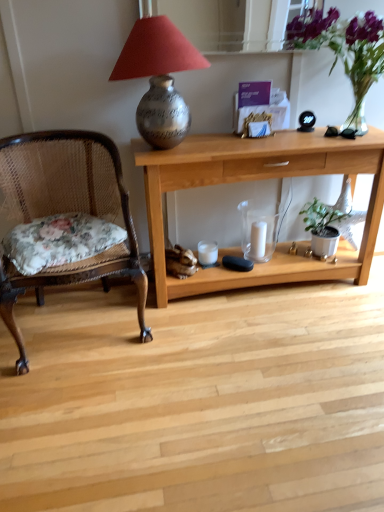
Identify the location of vacant space underneath woven wood chair with floral cushion at left (from a real-world perspective). The height and width of the screenshot is (512, 384). (74, 330).